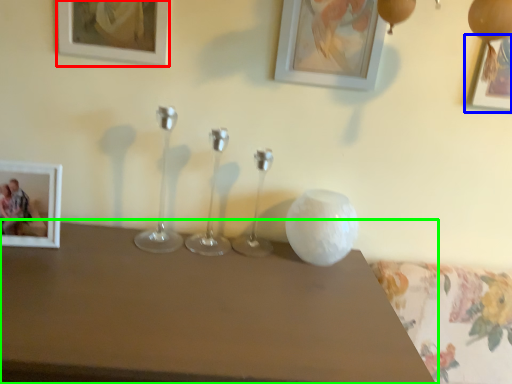
Question: Based on their relative distances, which object is nearer to picture frame (highlighted by a red box)? Choose from picture frame (highlighted by a blue box) and table (highlighted by a green box).

Choices:
 (A) picture frame
 (B) table

Answer: (B)